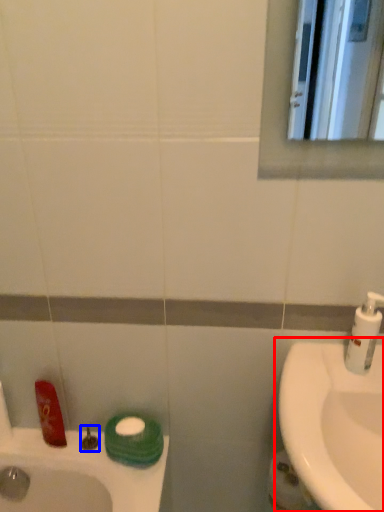
Question: Which object is further to the camera taking this photo, sink (highlighted by a red box) or plumbing fixture (highlighted by a blue box)?

Choices:
 (A) sink
 (B) plumbing fixture

Answer: (B)